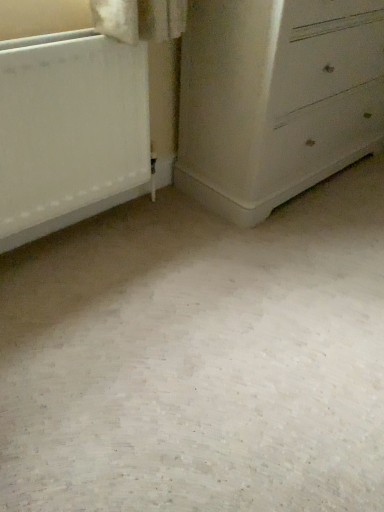
The image size is (384, 512). I want to click on white painted wood chest of drawers at right, so click(x=276, y=99).

What do you see at coordinates (276, 99) in the screenshot? I see `white painted wood chest of drawers at right` at bounding box center [276, 99].

Measure the distance between point (230, 97) and camera.

4.74 feet.

Where is `white painted wood chest of drawers at right`? white painted wood chest of drawers at right is located at coordinates (276, 99).